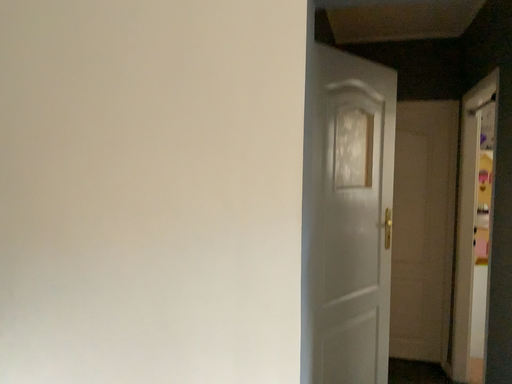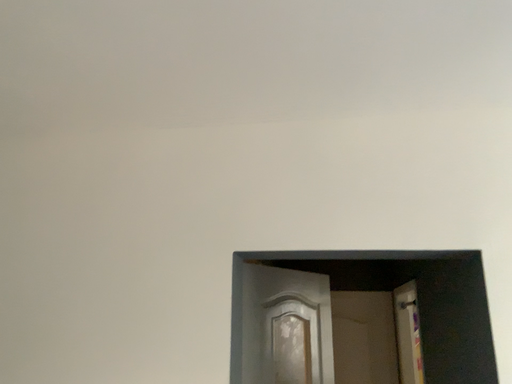
Question: How did the camera likely rotate when shooting the video?

Choices:
 (A) rotated upward
 (B) rotated downward

Answer: (A)